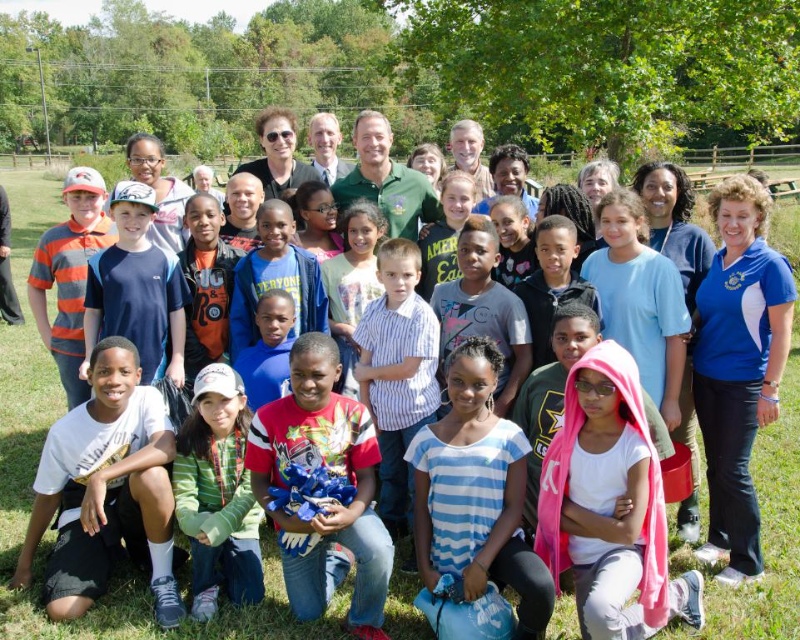
You are a photographer trying to capture a photo of the blue striped shirt at center and the red cotton shirt at center. Which one is positioned lower in the image?

The blue striped shirt at center is located below the red cotton shirt at center, so the blue striped shirt at center is positioned lower in the image.

You are organizing a group photo and need to arrange the two adults wearing the blue striped shirt at center and the red cotton shirt at center so that the smaller one is in front. Which shirt should be placed in front?

The blue striped shirt at center is smaller than the red cotton shirt at center, so it should be placed in front to ensure visibility.

You are organizing a group photo and need to arrange the people so that the red cotton shirt at center and the green fleece jacket at lower center are visible. Based on their current positions, which one should be moved to the left to ensure both are in the frame?

The red cotton shirt at center should be moved to the left since it is currently on the right side of the green fleece jacket at lower center, so shifting it left would allow both to be in the frame.